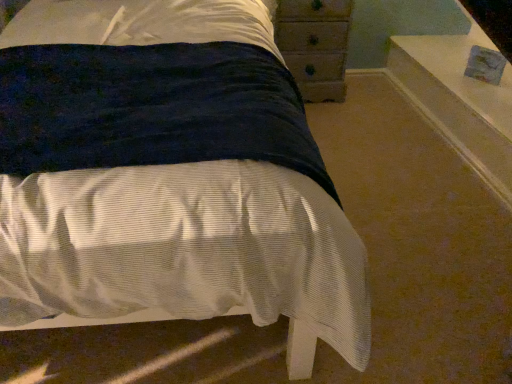
Question: Based on their sizes in the image, would you say wooden chest of drawers at upper right is bigger or smaller than velvet dark blue bed at center?

Choices:
 (A) small
 (B) big

Answer: (A)

Question: In terms of height, does wooden chest of drawers at upper right look taller or shorter compared to velvet dark blue bed at center?

Choices:
 (A) short
 (B) tall

Answer: (B)

Question: Estimate the real-world distances between objects in this image. Which object is farther from the velvet dark blue bed at center?

Choices:
 (A) wooden chest of drawers at upper right
 (B) white glossy window sill at upper right

Answer: (B)

Question: Which object is positioned closest to the white glossy window sill at upper right?

Choices:
 (A) velvet dark blue bed at center
 (B) wooden chest of drawers at upper right

Answer: (B)